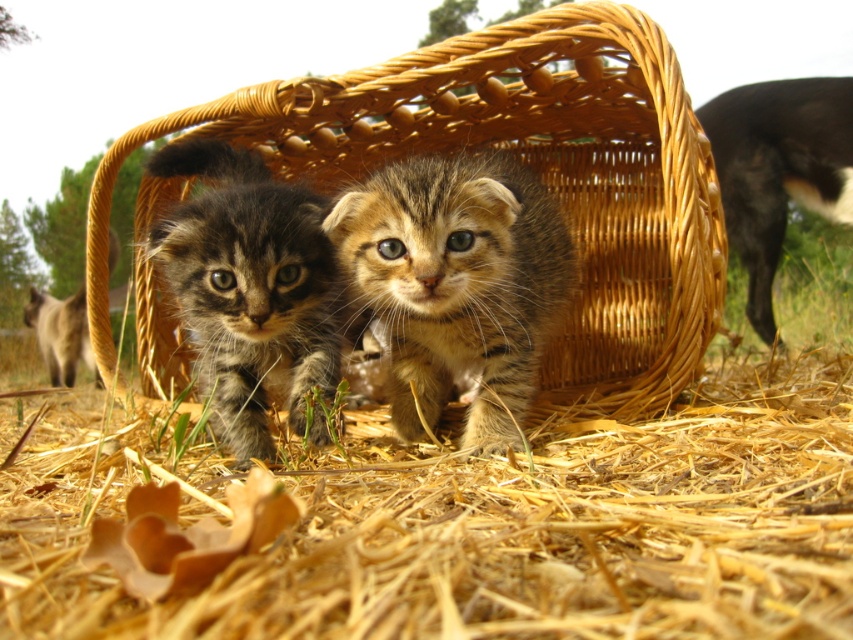
Is tabby fur kitten at center further to the viewer compared to striped fur kitten at center?

No, tabby fur kitten at center is in front of striped fur kitten at center.

Between tabby fur kitten at center and striped fur kitten at center, which one appears on the right side from the viewer's perspective?

Positioned to the right is tabby fur kitten at center.

This screenshot has width=853, height=640. What do you see at coordinates (457, 285) in the screenshot?
I see `tabby fur kitten at center` at bounding box center [457, 285].

The width and height of the screenshot is (853, 640). Find the location of `tabby fur kitten at center`. tabby fur kitten at center is located at coordinates (457, 285).

Who is higher up, striped fur kitten at center or black fur dog at upper right?

black fur dog at upper right

Is striped fur kitten at center above black fur dog at upper right?

Actually, striped fur kitten at center is below black fur dog at upper right.

Image resolution: width=853 pixels, height=640 pixels. What do you see at coordinates (250, 291) in the screenshot?
I see `striped fur kitten at center` at bounding box center [250, 291].

Find the location of a particular element. The height and width of the screenshot is (640, 853). striped fur kitten at center is located at coordinates (250, 291).

Does dry straw at lower center have a lesser height compared to black fur dog at upper right?

Yes.

Measure the distance between dry straw at lower center and black fur dog at upper right.

dry straw at lower center and black fur dog at upper right are 1.16 meters apart from each other.

Does point (746, 428) come closer to viewer compared to point (752, 216)?

Yes.

The height and width of the screenshot is (640, 853). Find the location of `dry straw at lower center`. dry straw at lower center is located at coordinates (498, 529).